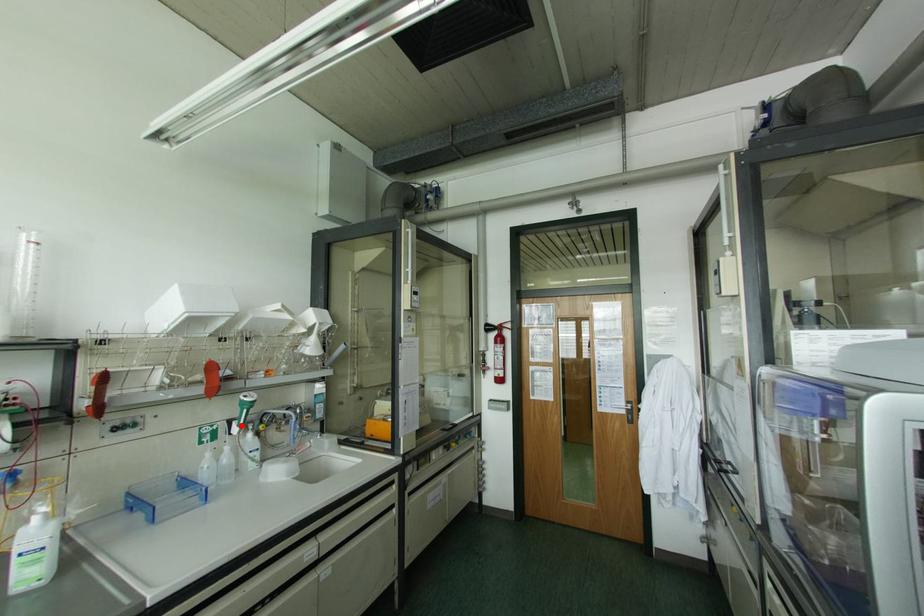
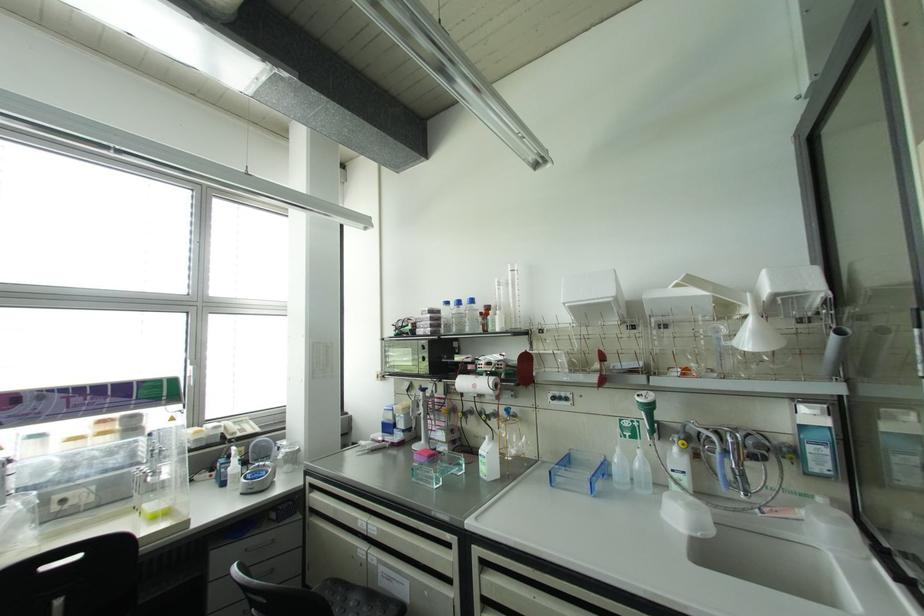
Where in the second image is the point corresponding to the highlighted location from the first image?

(650, 432)